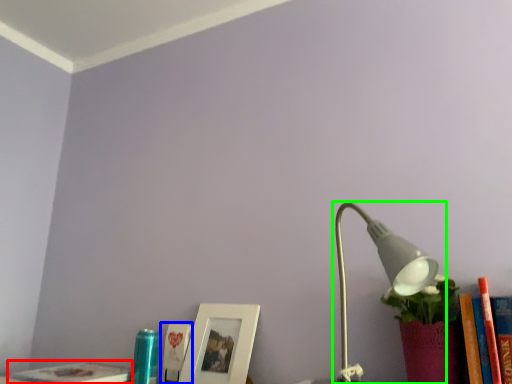
Question: Considering the real-world distances, which object is closest to book (highlighted by a red box)? book (highlighted by a blue box) or lamp (highlighted by a green box).

Choices:
 (A) book
 (B) lamp

Answer: (A)